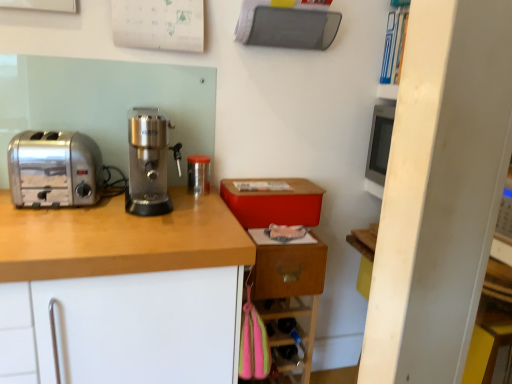
Question: Is wooden drawer at lower right inside or outside of transparent plastic container at center?

Choices:
 (A) outside
 (B) inside

Answer: (A)

Question: In the image, is wooden drawer at lower right on the left side or the right side of transparent plastic container at center?

Choices:
 (A) left
 (B) right

Answer: (B)

Question: Which is farther from the wooden drawer at lower right?

Choices:
 (A) transparent plastic container at center
 (B) satin silver coffee grinder at center
 (C) wooden at left
 (D) satin silver toaster at left

Answer: (D)

Question: Which is farther from the wooden drawer at lower right?

Choices:
 (A) satin silver toaster at left
 (B) wooden at left
 (C) transparent plastic container at center
 (D) satin silver coffee grinder at center

Answer: (A)